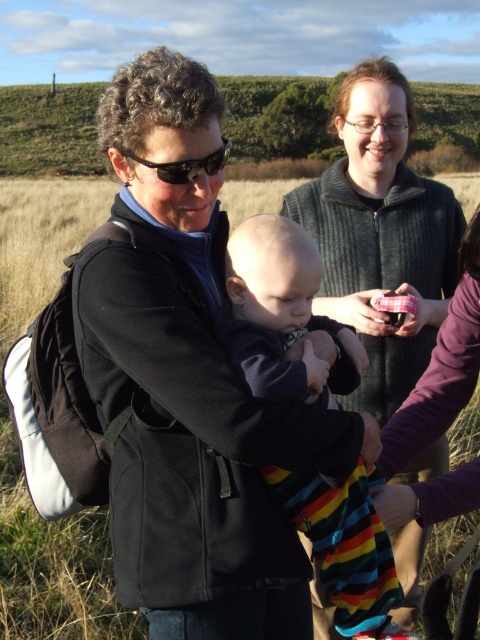
Question: Is knitted sweater at upper center to the right of striped cotton baby at center from the viewer's perspective?

Choices:
 (A) no
 (B) yes

Answer: (B)

Question: Is striped cotton baby at center bigger than black plastic sunglasses at center?

Choices:
 (A) no
 (B) yes

Answer: (A)

Question: Estimate the real-world distances between objects in this image. Which object is farther from the knitted sweater at upper center?

Choices:
 (A) black plastic sunglasses at center
 (B) striped cotton baby at center

Answer: (B)

Question: Estimate the real-world distances between objects in this image. Which object is farther from the striped cotton baby at center?

Choices:
 (A) black plastic sunglasses at center
 (B) knitted sweater at upper center

Answer: (B)

Question: Which of the following is the closest to the observer?

Choices:
 (A) black plastic sunglasses at center
 (B) knitted sweater at upper center
 (C) striped cotton baby at center

Answer: (C)

Question: Does knitted sweater at upper center appear on the right side of black plastic sunglasses at center?

Choices:
 (A) yes
 (B) no

Answer: (A)